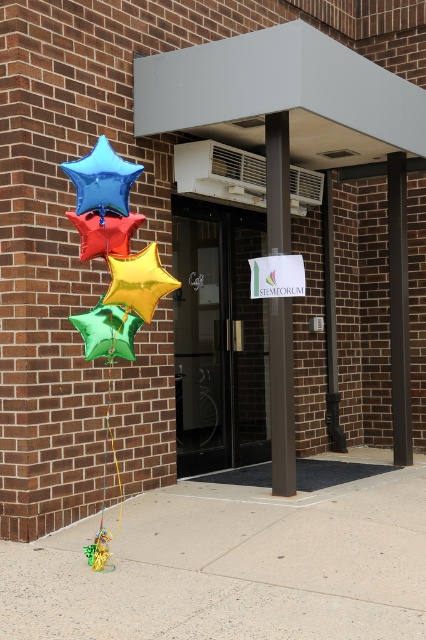
From the picture: Can you confirm if black metal/texture pillar at right is positioned below blue metallic star at left?

Indeed, black metal/texture pillar at right is positioned under blue metallic star at left.

Between point (391, 212) and point (104, 152), which one is positioned in front?

Point (104, 152) is more forward.

Who is more forward, (394, 307) or (117, 193)?

Point (117, 193)

Find the location of a particular element. black metal/texture pillar at right is located at coordinates (399, 308).

Does transparent glass door at center have a smaller size compared to green metallic star at lower left?

No, transparent glass door at center is not smaller than green metallic star at lower left.

Where is `transparent glass door at center`? transparent glass door at center is located at coordinates (218, 339).

You are a GUI agent. You are given a task and a screenshot of the screen. Output one action in this format:
    pyautogui.click(x=<x>, y=<y>)
    Task: Click on the transparent glass door at center
    
    Given the screenshot: What is the action you would take?
    pyautogui.click(x=218, y=339)

Between smooth concrete pavement at center and gold metallic star at center, which one is positioned higher?

Positioned higher is gold metallic star at center.

Where is `smooth concrete pavement at center`? This screenshot has width=426, height=640. smooth concrete pavement at center is located at coordinates (236, 563).

Identify the location of smooth concrete pavement at center. (236, 563).

This screenshot has width=426, height=640. Find the location of `smooth concrete pavement at center`. smooth concrete pavement at center is located at coordinates (236, 563).